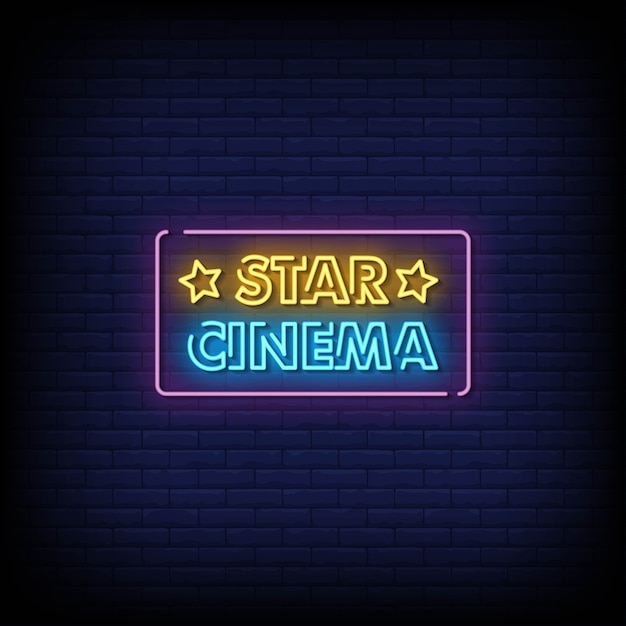
Locate an element on the screen. This screenshot has width=626, height=626. yellow neon letters is located at coordinates (258, 288), (290, 288), (322, 287), (370, 287).